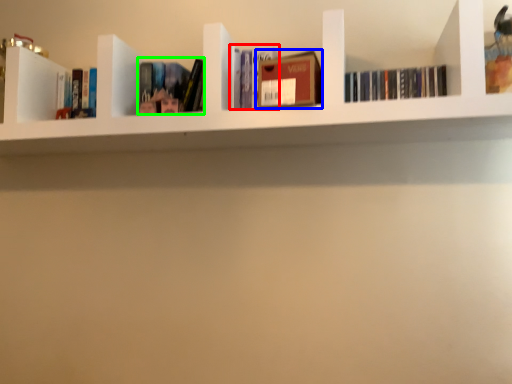
Question: Which is nearer to the book (highlighted by a red box)? book (highlighted by a blue box) or book (highlighted by a green box).

Choices:
 (A) book
 (B) book

Answer: (A)